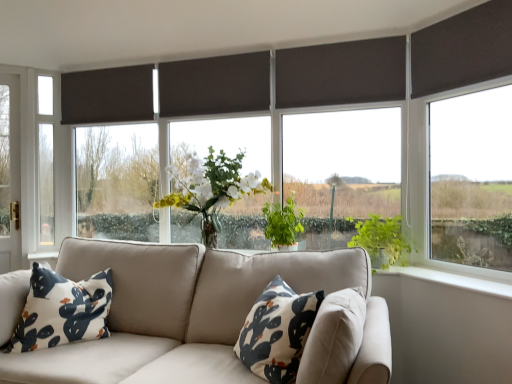
Question: Are dark matte blind at center, which is the third window in left-to-right order, and dark brown fabric blind at upper right making contact?

Choices:
 (A) no
 (B) yes

Answer: (A)

Question: Is dark matte blind at center, the second window when ordered from front to back, thinner than dark brown fabric blind at upper right?

Choices:
 (A) no
 (B) yes

Answer: (A)

Question: Does dark matte blind at center, the second window in the right-to-left sequence, have a greater width compared to dark brown fabric blind at upper right?

Choices:
 (A) no
 (B) yes

Answer: (B)

Question: From the image's perspective, does dark matte blind at center, marked as the third window in a back-to-front arrangement, appear lower than dark brown fabric blind at upper right?

Choices:
 (A) yes
 (B) no

Answer: (A)

Question: From the image's perspective, is dark matte blind at center, the second window in the right-to-left sequence, on top of dark brown fabric blind at upper right?

Choices:
 (A) yes
 (B) no

Answer: (B)

Question: From a real-world perspective, is matte black curtain at upper left, the 1th curtain viewed from the left, physically located above or below green leafy plant at right, the 2th vegetation from the left?

Choices:
 (A) below
 (B) above

Answer: (B)

Question: From their relative heights in the image, would you say matte black curtain at upper left, which ranks as the second curtain in right-to-left order, is taller or shorter than green leafy plant at right, the 2th vegetation from the left?

Choices:
 (A) tall
 (B) short

Answer: (A)

Question: Considering their positions, is matte black curtain at upper left, the 1th curtain viewed from the left, located in front of or behind green leafy plant at right, the 2th vegetation from the left?

Choices:
 (A) front
 (B) behind

Answer: (B)

Question: Looking at the image, does matte black curtain at upper left, which is the second curtain from front to back, seem bigger or smaller compared to green leafy plant at right, which is counted as the 1th vegetation, starting from the right?

Choices:
 (A) big
 (B) small

Answer: (B)

Question: Considering the positions of dark matte blind at center, which is the third window in left-to-right order, and green leafy tree at left in the image, is dark matte blind at center, which is the third window in left-to-right order, wider or thinner than green leafy tree at left?

Choices:
 (A) wide
 (B) thin

Answer: (B)

Question: Is point (296, 137) closer or farther from the camera than point (6, 178)?

Choices:
 (A) closer
 (B) farther

Answer: (A)

Question: From a real-world perspective, relative to green leafy tree at left, is dark matte blind at center, the second window in the right-to-left sequence, vertically above or below?

Choices:
 (A) below
 (B) above

Answer: (B)

Question: Is dark matte blind at center, the second window in the right-to-left sequence, in front of or behind green leafy tree at left in the image?

Choices:
 (A) behind
 (B) front

Answer: (B)

Question: Is dark matte blind at center, the second window when ordered from front to back, bigger or smaller than matte black curtain at upper left, which ranks as the second curtain in right-to-left order?

Choices:
 (A) small
 (B) big

Answer: (B)

Question: Is dark matte blind at center, the second window when ordered from front to back, in front of or behind matte black curtain at upper left, which is the second curtain from front to back, in the image?

Choices:
 (A) behind
 (B) front

Answer: (B)